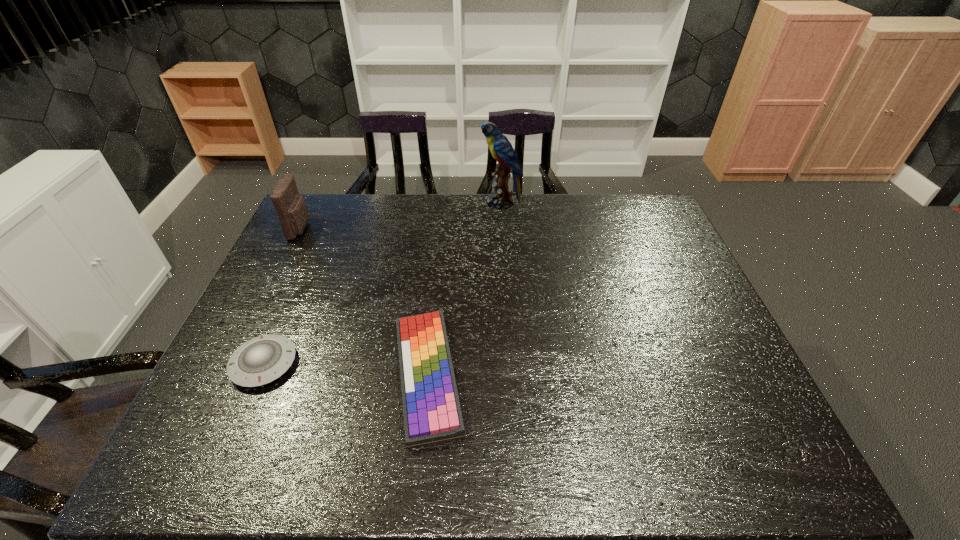
This screenshot has width=960, height=540. Find the location of `free space that satisfies the following two spatial constraints: 1. with an open flap on the pouch; 2. on the right side of the saucer`. free space that satisfies the following two spatial constraints: 1. with an open flap on the pouch; 2. on the right side of the saucer is located at coordinates (233, 364).

Find the location of a particular element. The image size is (960, 540). free location that satisfies the following two spatial constraints: 1. with an open flap on the second farthest object; 2. on the left side of the computer keyboard is located at coordinates (228, 375).

Locate an element on the screen. vacant region that satisfies the following two spatial constraints: 1. with an open flap on the pouch; 2. on the back side of the second object from right to left is located at coordinates (228, 375).